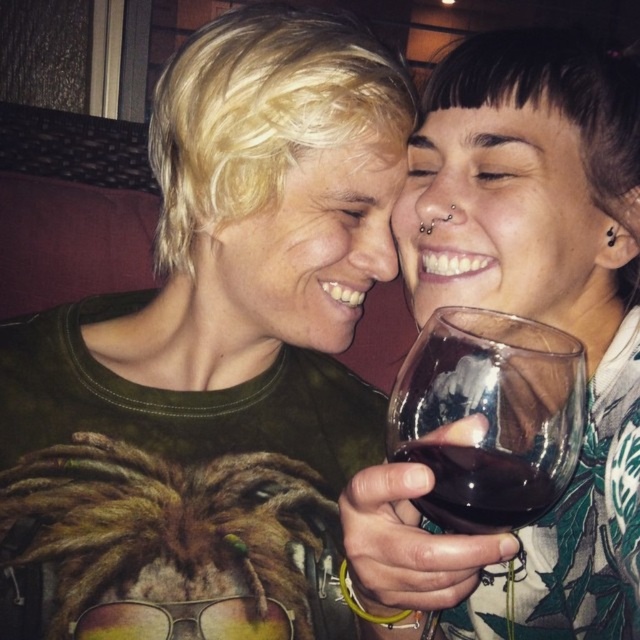
You are a bartender preparing drinks for two customers. You have a translucent glass wine at upper right and a transparent glass at center. Which glass should you choose if you need a larger one for a cocktail?

The translucent glass wine at upper right is larger in size than the transparent glass at center, so you should choose the translucent glass wine at upper right for the cocktail.

You are a bartender who needs to pour a drink into the larger glass. Which glass should you choose between the transparent glass at center and the dark glass at center?

The transparent glass at center is larger in size than the dark glass at center, so you should choose the transparent glass at center to pour the drink.